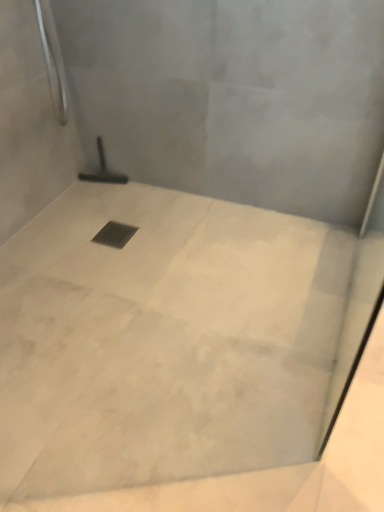
Question: Is black metal drain at center completely or partially inside black rubber squeegee at center?

Choices:
 (A) no
 (B) yes

Answer: (A)

Question: From a real-world perspective, is black rubber squeegee at center under black metal drain at center?

Choices:
 (A) no
 (B) yes

Answer: (A)

Question: Can we say black rubber squeegee at center lies outside black metal drain at center?

Choices:
 (A) no
 (B) yes

Answer: (B)

Question: Is the surface of black rubber squeegee at center in direct contact with black metal drain at center?

Choices:
 (A) yes
 (B) no

Answer: (B)

Question: From a real-world perspective, is black rubber squeegee at center positioned over black metal drain at center based on gravity?

Choices:
 (A) yes
 (B) no

Answer: (A)

Question: In terms of height, does black metal drain at center look taller or shorter compared to white marble floor at center?

Choices:
 (A) short
 (B) tall

Answer: (A)

Question: From the image's perspective, relative to white marble floor at center, is black metal drain at center above or below?

Choices:
 (A) above
 (B) below

Answer: (A)

Question: From a real-world perspective, is black metal drain at center positioned above or below white marble floor at center?

Choices:
 (A) above
 (B) below

Answer: (B)

Question: Is black metal drain at center bigger or smaller than white marble floor at center?

Choices:
 (A) big
 (B) small

Answer: (B)

Question: Looking at their shapes, would you say white marble floor at center is wider or thinner than black rubber squeegee at center?

Choices:
 (A) wide
 (B) thin

Answer: (A)

Question: From the image's perspective, is white marble floor at center positioned above or below black rubber squeegee at center?

Choices:
 (A) below
 (B) above

Answer: (A)

Question: Considering their positions, is white marble floor at center located in front of or behind black rubber squeegee at center?

Choices:
 (A) front
 (B) behind

Answer: (A)

Question: Is point (342, 276) positioned closer to the camera than point (109, 180)?

Choices:
 (A) closer
 (B) farther

Answer: (A)

Question: From a real-world perspective, relative to black rubber squeegee at center, is black metal drain at center vertically above or below?

Choices:
 (A) above
 (B) below

Answer: (B)

Question: In terms of width, does black metal drain at center look wider or thinner when compared to black rubber squeegee at center?

Choices:
 (A) thin
 (B) wide

Answer: (B)